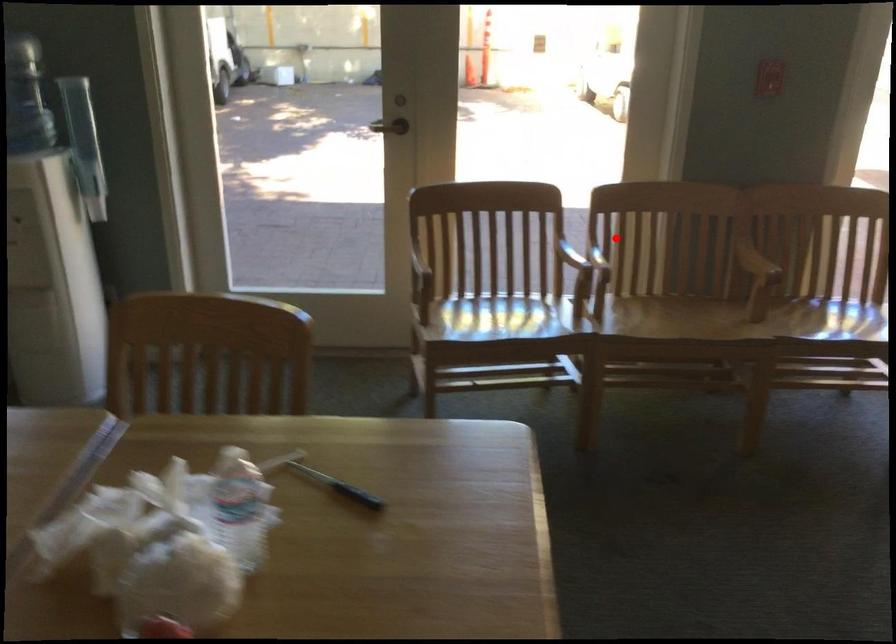
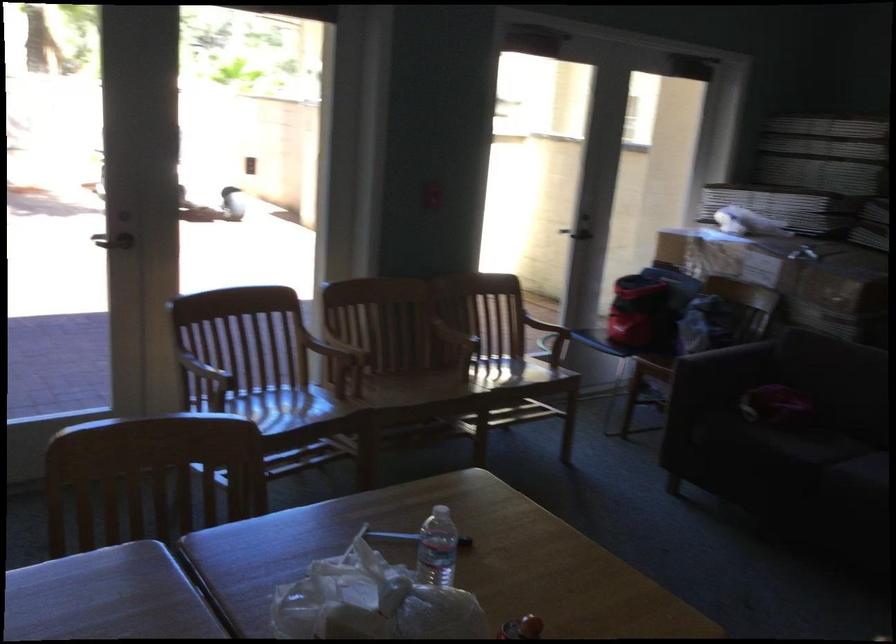
Question: I am providing you with two images of the same scene from different viewpoints. Image1 has a red point marked. In image2, the corresponding 3D location appears at what relative position? Reply with the corresponding letter.

Choices:
 (A) Closer
 (B) Farther

Answer: (B)